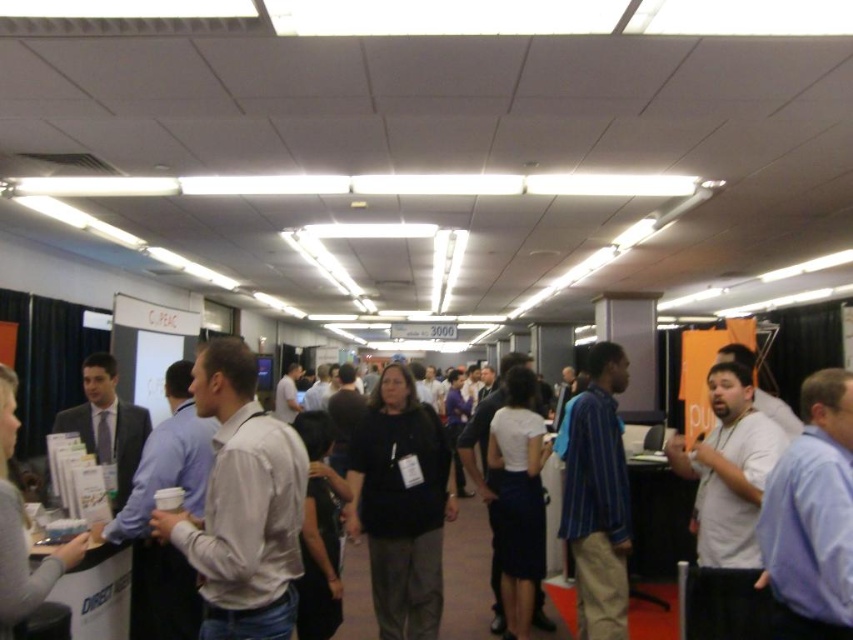
Can you confirm if white paper at center is taller than matte gray shirt at left?

Incorrect, white paper at center's height is not larger of matte gray shirt at left's.

Which is behind, point (660, 612) or point (15, 541)?

The point (660, 612) is more distant.

Image resolution: width=853 pixels, height=640 pixels. Find the location of `white paper at center`. white paper at center is located at coordinates (465, 573).

Can you confirm if white shirt at left is shorter than matte black suit at left?

Incorrect, white shirt at left's height does not fall short of matte black suit at left's.

The height and width of the screenshot is (640, 853). What are the coordinates of `white shirt at left` in the screenshot? It's located at (242, 504).

Is light blue shirt at right positioned before matte black suit at left?

Yes.

Is point (804, 500) positioned in front of point (149, 424)?

Yes, it is.

You are a GUI agent. You are given a task and a screenshot of the screen. Output one action in this format:
    pyautogui.click(x=<x>, y=<y>)
    Task: Click on the light blue shirt at right
    This screenshot has width=853, height=640.
    Given the screenshot: What is the action you would take?
    pyautogui.click(x=811, y=516)